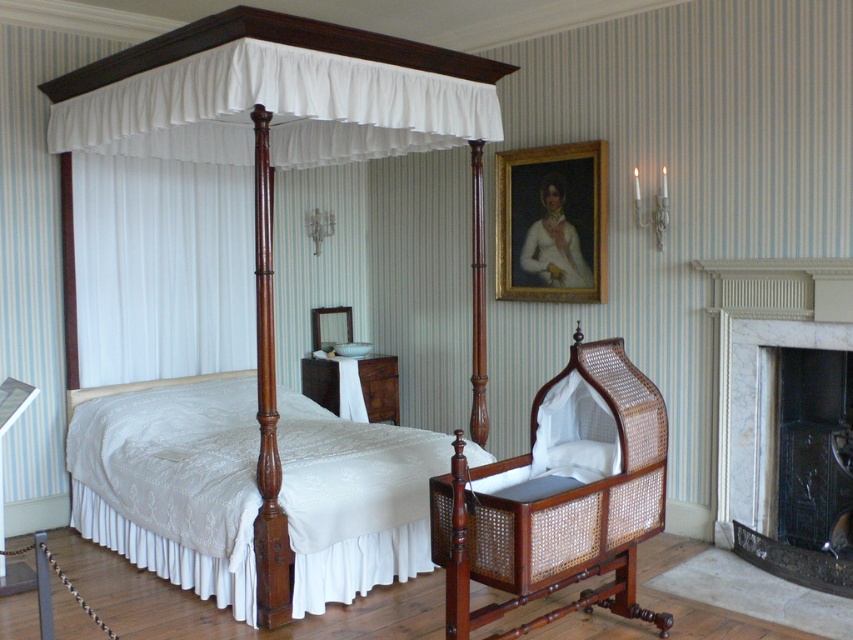
You are standing in the vintage bedroom and want to place a small decoration between the two points, point (355, 493) and point (602, 394). Which point should the decoration be closer to in order to ensure it is in front of both points?

The decoration should be closer to point (602, 394) because point (355, 493) is behind point (602, 394), so placing it near the front point would keep it in front of both.

You are standing in the vintage bedroom and want to move from the point at the bottom left corner to the point at the bottom right corner. There are two points marked in the room, one at coordinates point [154,161] and the other at point [724,440]. Which point is closer to your starting position?

Point [154,161] is closer to your starting position because it is behind point [724,440], meaning it is further away from the viewer and thus closer to the bottom left corner.